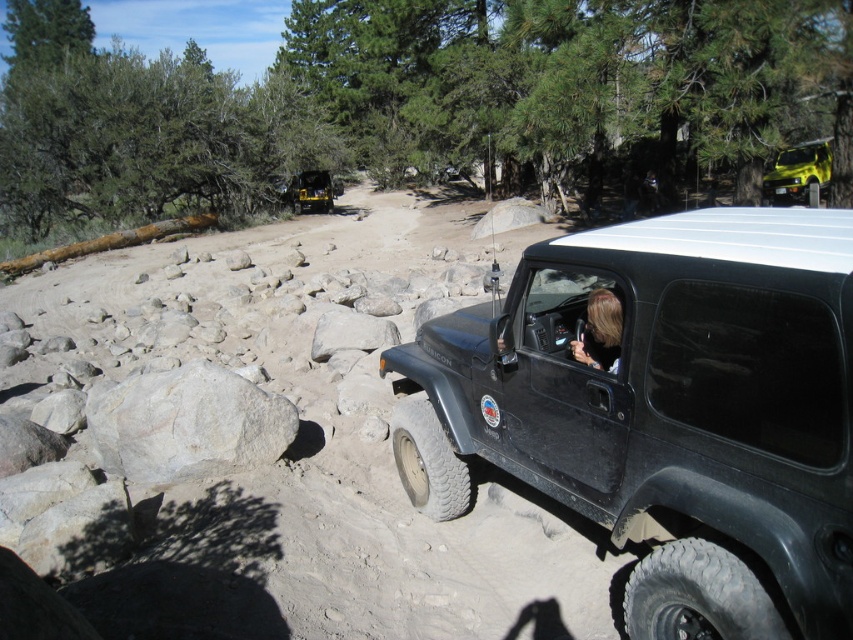
Question: Which point is closer to the camera taking this photo?

Choices:
 (A) (612, 326)
 (B) (779, 232)
 (C) (364, 337)
 (D) (167, 371)

Answer: (B)

Question: Does shiny yellow car at upper right have a greater width compared to matte yellow truck at center?

Choices:
 (A) yes
 (B) no

Answer: (A)

Question: Does gray rough rock at lower left appear on the right side of matte yellow truck at center?

Choices:
 (A) no
 (B) yes

Answer: (B)

Question: Is the position of gray rough rock at lower left less distant than that of blonde hair at center?

Choices:
 (A) yes
 (B) no

Answer: (B)

Question: Which object is farther from the camera taking this photo?

Choices:
 (A) gray rough rock at lower left
 (B) matte black jeep at center
 (C) blonde hair at center
 (D) shiny yellow car at upper right

Answer: (D)

Question: Which is nearer to the blonde hair at center?

Choices:
 (A) shiny yellow car at upper right
 (B) gray rock at center
 (C) matte black jeep at center

Answer: (C)